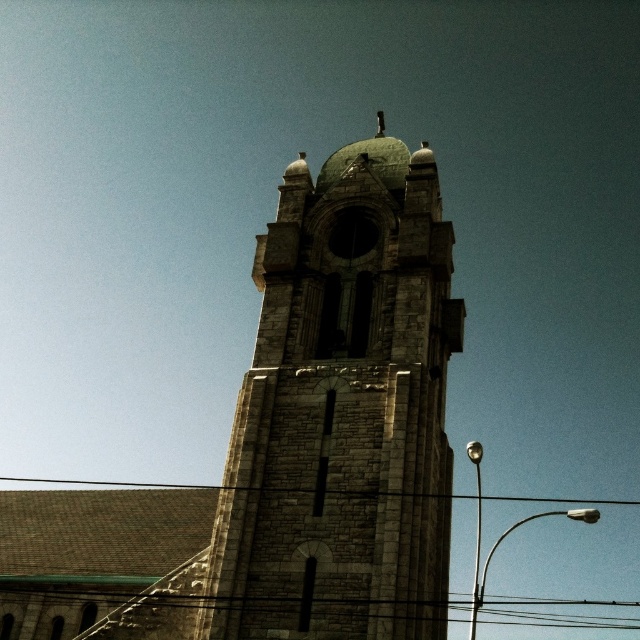
Does stone tower at center have a greater width compared to black wire at lower center?

No.

Which is in front, point (352, 412) or point (593, 499)?

Point (352, 412) is in front.

Identify the location of stone tower at center. (342, 412).

Locate an element on the screen. This screenshot has height=640, width=640. stone tower at center is located at coordinates (342, 412).